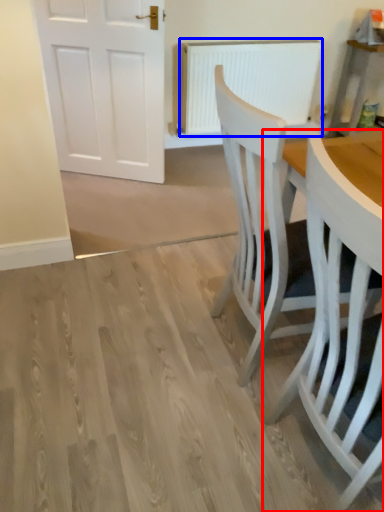
Question: Which point is further to the camera, chair (highlighted by a red box) or radiator (highlighted by a blue box)?

Choices:
 (A) chair
 (B) radiator

Answer: (B)